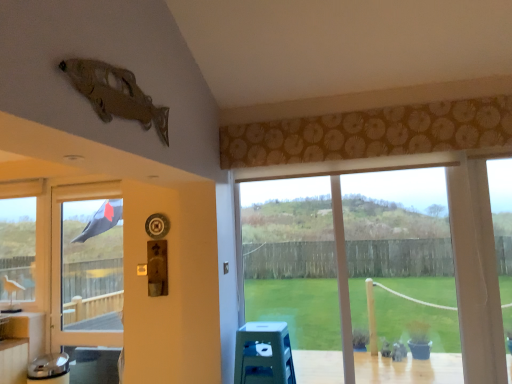
Locate an element on the screen. Image resolution: width=512 pixels, height=384 pixels. free point above black fabric screen door at left (from a real-world perspective) is located at coordinates (84, 177).